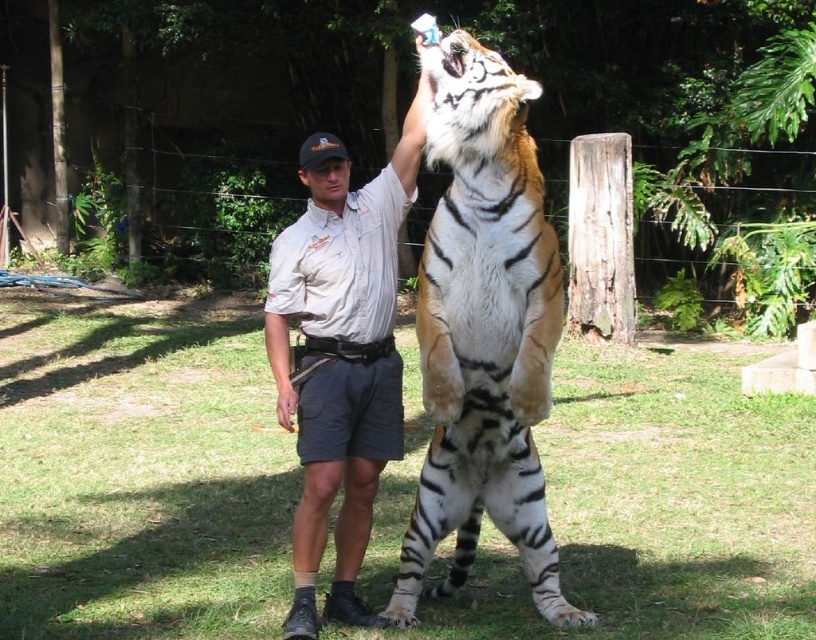
Can you confirm if white and black striped tiger at center is taller than white cotton shirt at center?

Indeed, white and black striped tiger at center has a greater height compared to white cotton shirt at center.

Between point (533, 588) and point (426, 92), which one is positioned behind?

The point (533, 588) is behind.

This screenshot has width=816, height=640. In order to click on white and black striped tiger at center in this screenshot , I will do `click(482, 332)`.